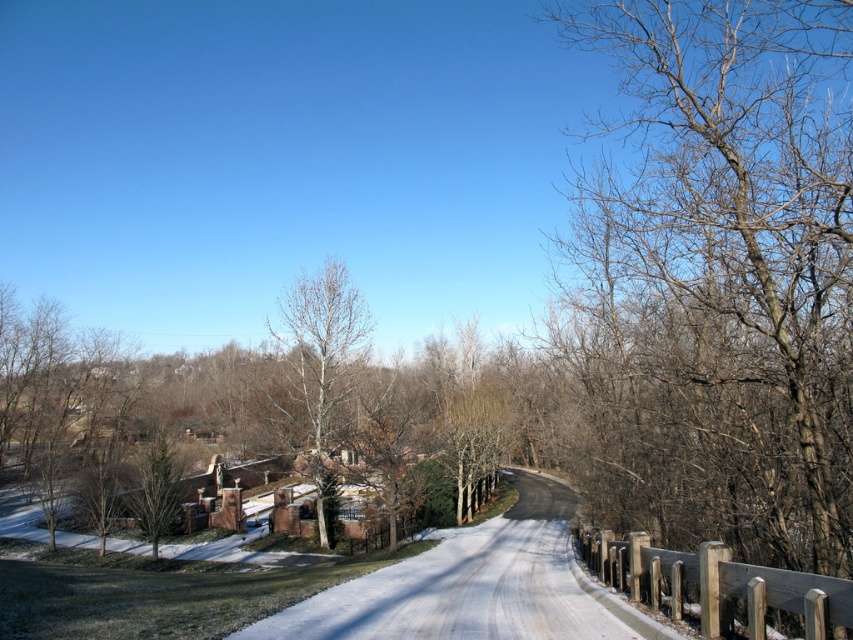
Question: Can you confirm if bare branches at right is wider than bare wood tree at center?

Choices:
 (A) no
 (B) yes

Answer: (A)

Question: Can you confirm if bare branches at right is positioned below bare wood tree at center?

Choices:
 (A) yes
 (B) no

Answer: (B)

Question: Which point appears closest to the camera in this image?

Choices:
 (A) (300, 280)
 (B) (627, 372)

Answer: (B)

Question: Is bare branches at right above bare wood tree at center?

Choices:
 (A) yes
 (B) no

Answer: (A)

Question: Which point is farther to the camera?

Choices:
 (A) bare wood tree at center
 (B) bare branches at right

Answer: (A)